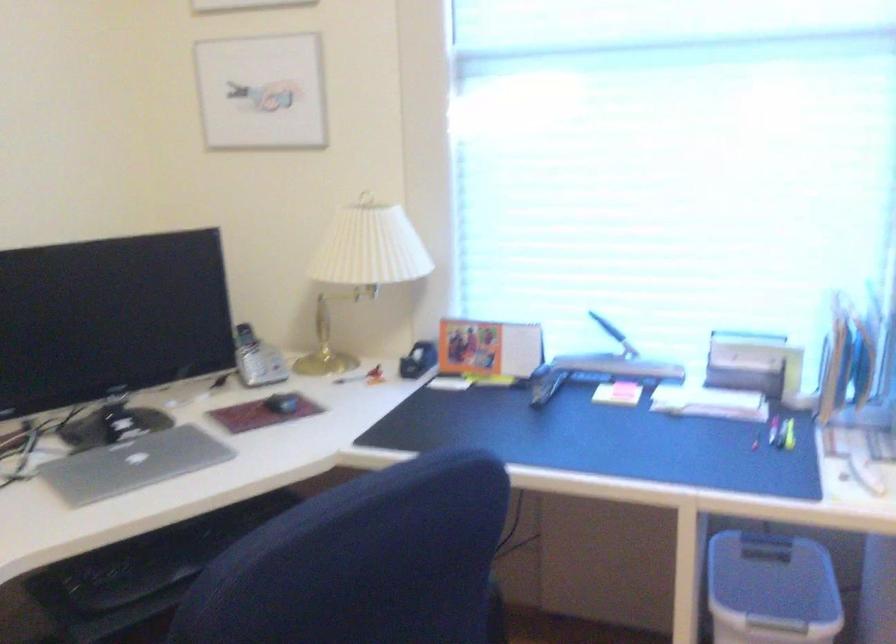
What are the coordinates of `black tape dispenser` in the screenshot? It's located at (418, 360).